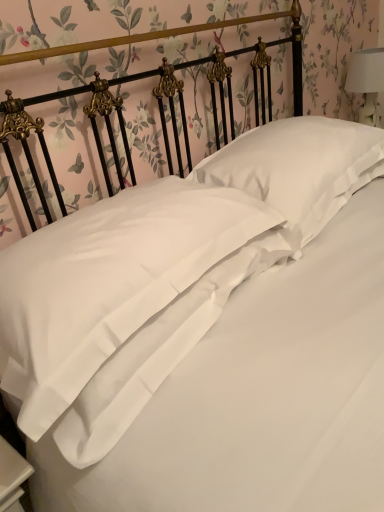
Question: Can you confirm if satin white pillow at center, marked as the second pillow in a right-to-left arrangement, is smaller than white fabric lampshade at upper right?

Choices:
 (A) yes
 (B) no

Answer: (B)

Question: Does satin white pillow at center, marked as the second pillow in a right-to-left arrangement, have a greater height compared to white fabric lampshade at upper right?

Choices:
 (A) yes
 (B) no

Answer: (B)

Question: From a real-world perspective, is satin white pillow at center, which is counted as the 1th pillow, starting from the left, over white fabric lampshade at upper right?

Choices:
 (A) yes
 (B) no

Answer: (B)

Question: Is satin white pillow at center, which is counted as the 1th pillow, starting from the left, aimed at white fabric lampshade at upper right?

Choices:
 (A) no
 (B) yes

Answer: (A)

Question: Is satin white pillow at center, marked as the second pillow in a right-to-left arrangement, to the right of white fabric lampshade at upper right from the viewer's perspective?

Choices:
 (A) yes
 (B) no

Answer: (B)

Question: Is satin white pillow at center, which is counted as the 1th pillow, starting from the left, with white fabric lampshade at upper right?

Choices:
 (A) no
 (B) yes

Answer: (A)

Question: Is satin white pillow at center, marked as the second pillow in a right-to-left arrangement, positioned in front of white satin pillow at center, the 2th pillow positioned from the left?

Choices:
 (A) no
 (B) yes

Answer: (B)

Question: Considering the relative positions of satin white pillow at center, marked as the second pillow in a right-to-left arrangement, and white satin pillow at center, the 2th pillow positioned from the left, in the image provided, is satin white pillow at center, marked as the second pillow in a right-to-left arrangement, to the right of white satin pillow at center, the 2th pillow positioned from the left, from the viewer's perspective?

Choices:
 (A) yes
 (B) no

Answer: (B)

Question: Is the surface of satin white pillow at center, which is counted as the 1th pillow, starting from the left, in direct contact with white satin pillow at center, which is the first pillow in right-to-left order?

Choices:
 (A) yes
 (B) no

Answer: (B)

Question: Does satin white pillow at center, which is counted as the 1th pillow, starting from the left, have a greater width compared to white satin pillow at center, which is the first pillow in right-to-left order?

Choices:
 (A) yes
 (B) no

Answer: (A)

Question: From a real-world perspective, does satin white pillow at center, marked as the second pillow in a right-to-left arrangement, sit lower than white satin pillow at center, the 2th pillow positioned from the left?

Choices:
 (A) no
 (B) yes

Answer: (B)

Question: Is the position of satin white pillow at center, which is counted as the 1th pillow, starting from the left, more distant than that of white satin pillow at center, the 2th pillow positioned from the left?

Choices:
 (A) yes
 (B) no

Answer: (B)

Question: Is white satin pillow at center, the 2th pillow positioned from the left, to the left of satin white pillow at center, which is counted as the 1th pillow, starting from the left, from the viewer's perspective?

Choices:
 (A) no
 (B) yes

Answer: (A)